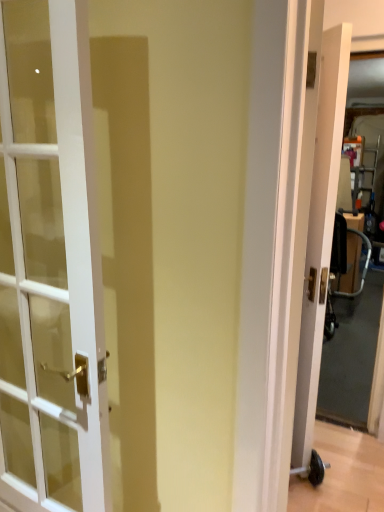
Question: Would you say metallic silver baby carriage at right is part of white wood door at right, acting as the 1th door starting from the right,'s contents?

Choices:
 (A) yes
 (B) no

Answer: (B)

Question: Does white wood door at right, which ranks as the second door in front-to-back order, lie behind metallic silver baby carriage at right?

Choices:
 (A) yes
 (B) no

Answer: (B)

Question: Would you consider white wood door at right, the 2th door from the left, to be distant from metallic silver baby carriage at right?

Choices:
 (A) yes
 (B) no

Answer: (A)

Question: Considering the relative positions of white wood door at right, which ranks as the second door in front-to-back order, and metallic silver baby carriage at right in the image provided, is white wood door at right, which ranks as the second door in front-to-back order, to the right of metallic silver baby carriage at right from the viewer's perspective?

Choices:
 (A) no
 (B) yes

Answer: (A)

Question: Can we say white wood door at right, which ranks as the second door in front-to-back order, lies outside metallic silver baby carriage at right?

Choices:
 (A) no
 (B) yes

Answer: (B)

Question: From the image's perspective, is metallic silver baby carriage at right above or below white glass door at left, which is the 2th door from right to left?

Choices:
 (A) above
 (B) below

Answer: (A)

Question: From a real-world perspective, is metallic silver baby carriage at right physically located above or below white glass door at left, placed as the 1th door when sorted from left to right?

Choices:
 (A) below
 (B) above

Answer: (A)

Question: Is metallic silver baby carriage at right to the left or to the right of white glass door at left, which appears as the second door when viewed from the back, in the image?

Choices:
 (A) right
 (B) left

Answer: (A)

Question: Is metallic silver baby carriage at right in front of or behind white glass door at left, placed as the 1th door when sorted from left to right, in the image?

Choices:
 (A) front
 (B) behind

Answer: (B)

Question: Is point [x=317, y=280] closer or farther from the camera than point [x=357, y=232]?

Choices:
 (A) closer
 (B) farther

Answer: (A)

Question: Do you think white wood door at right, the 1th door viewed from the back, is within metallic silver baby carriage at right, or outside of it?

Choices:
 (A) outside
 (B) inside

Answer: (A)

Question: From a real-world perspective, is white wood door at right, which ranks as the second door in front-to-back order, physically located above or below metallic silver baby carriage at right?

Choices:
 (A) above
 (B) below

Answer: (A)

Question: From the image's perspective, is white wood door at right, the 2th door from the left, located above or below metallic silver baby carriage at right?

Choices:
 (A) above
 (B) below

Answer: (A)

Question: Looking at the image, does metallic silver baby carriage at right seem bigger or smaller compared to white wood door at right, acting as the 1th door starting from the right?

Choices:
 (A) small
 (B) big

Answer: (B)

Question: In terms of height, does metallic silver baby carriage at right look taller or shorter compared to white wood door at right, the 1th door viewed from the back?

Choices:
 (A) short
 (B) tall

Answer: (A)